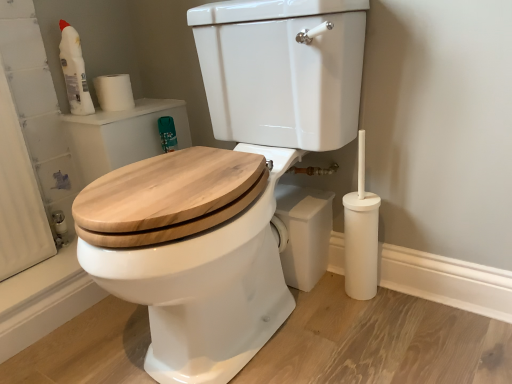
Find the location of a particular element. vacant space in between natural wood toilet seat at center and white plastic toilet brush at lower right is located at coordinates (337, 334).